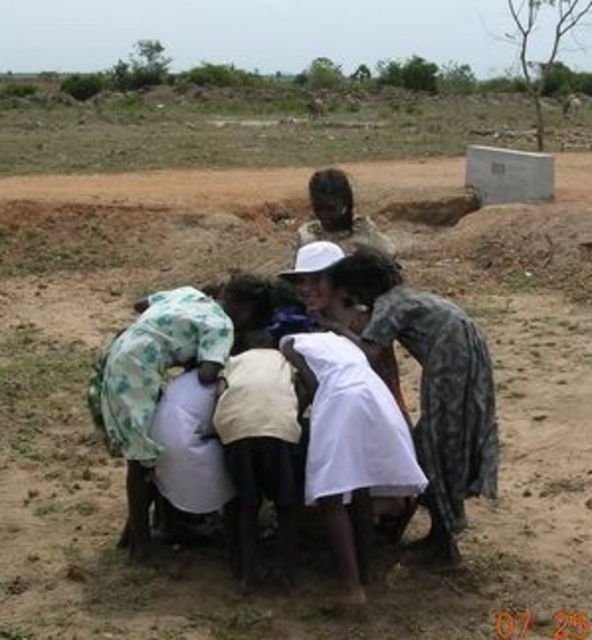
You are a photographer trying to capture a photo of the white cloth at center and the white clothed person at center. Which object should you focus on first if you want to ensure both are in focus without adjusting your camera settings?

The white cloth at center is not as tall as the white clothed person at center, so you should focus on the white clothed person at center first since it is taller and likely closer to the camera.

You are a photographer trying to capture a clear image of the white cloth at center and the white clothed person at center. Since both are white, you need to adjust your focus. Which object should you focus on first to ensure it appears sharp in the photo?

The white cloth at center is located below the white clothed person at center, so you should focus on the white clothed person at center first to ensure it appears sharp before adjusting for the white cloth at center.

You are a photographer trying to capture a clear shot of the white cloth at center and the white clothed person at center. Which object should you focus on first to ensure both are in focus?

The white cloth at center is closer to the viewer than the white clothed person at center, so you should focus on the white cloth at center first. This way, both will be in focus as the white clothed person at center is further away.